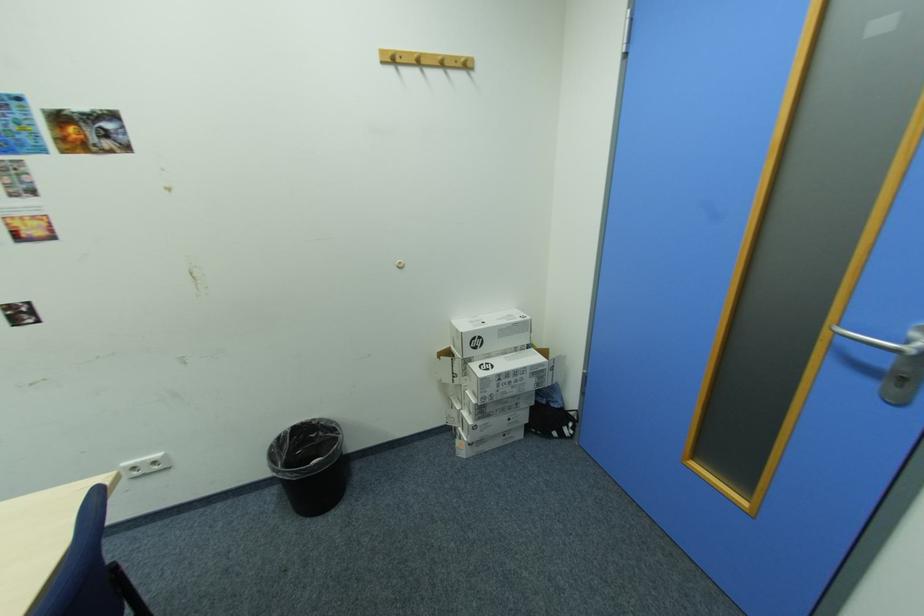
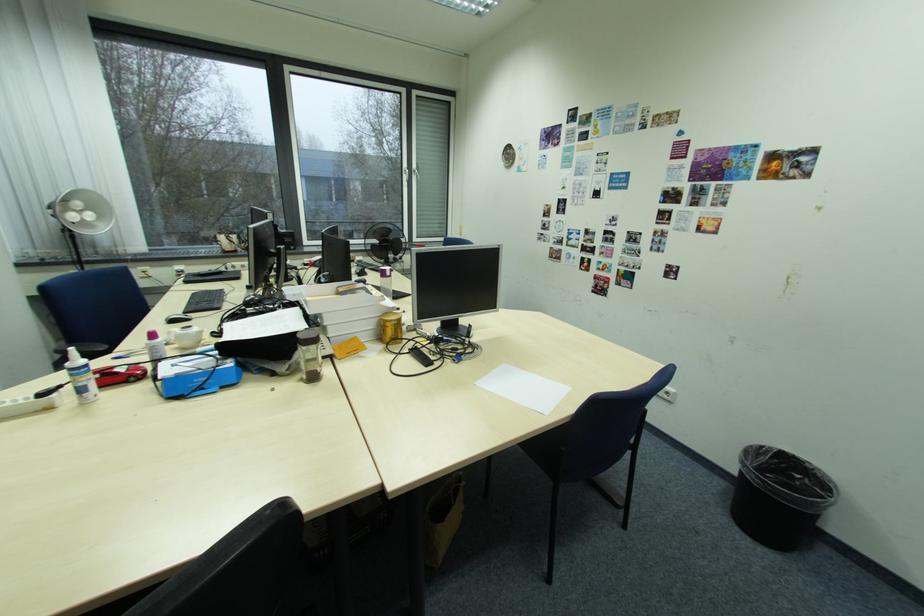
Based on the continuous images, in which direction is the camera rotating?

The rotation direction of the camera is left-down.